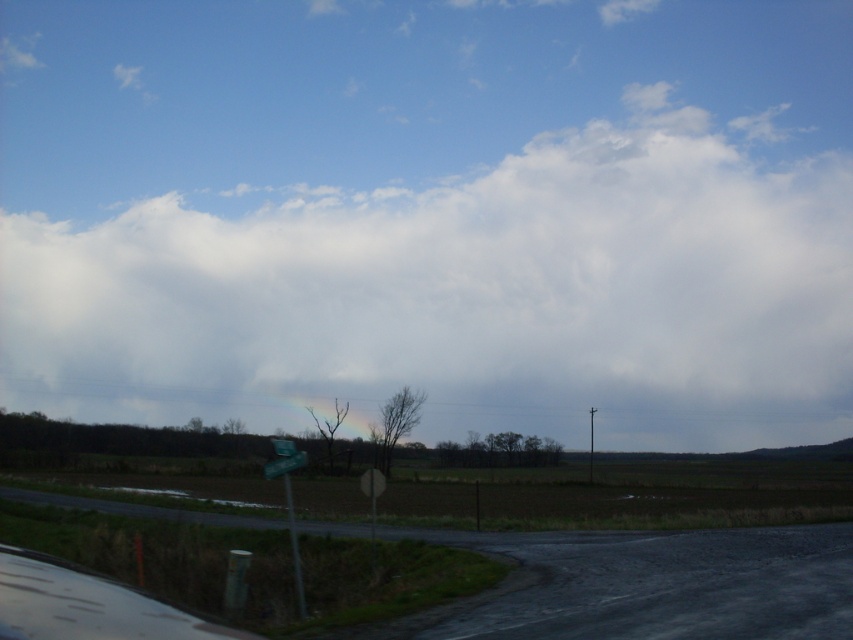
You are a driver approaching the green plastic street sign at lower left and the rainbow translucent at center. Which object appears wider from your perspective?

The rainbow translucent at center appears wider than the green plastic street sign at lower left because the street sign has a smaller width compared to the rainbow.